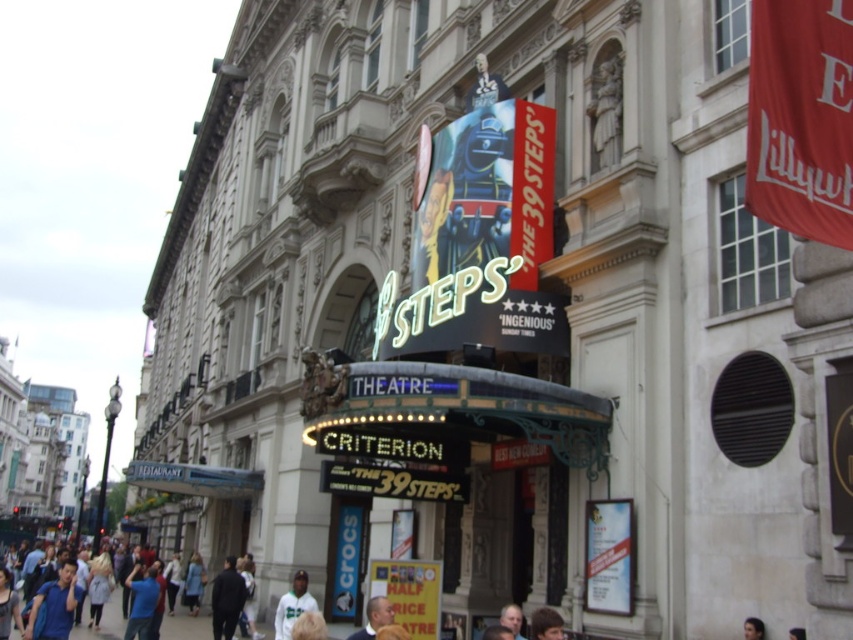
You are standing in front of the Criterion Theatre and want to find the white paper poster at lower right. Based on the scene description, where exactly would you look relative to the main entrance?

The white paper poster at lower right is located at the coordinates point [608,556] relative to the main entrance.

You are a photographer standing at the entrance of the Criterion Theatre. You want to take a photo that includes both the white plastic sign at lower center and the dark blue shirt at center. Given that your camera has a maximum focus range of 6 meters, will you be able to capture both objects in focus in a single shot?

The white plastic sign at lower center and dark blue shirt at center are 7.03 meters apart from each other. Since the distance between them exceeds the camera maximum focus range of 6 meters, the photographer cannot capture both objects in focus in a single shot.

Consider the image. You are standing in front of the Criterion Theatre and notice a white paper poster at lower right and a blue denim jacket at lower center. Which object is nearer to you?

The white paper poster at lower right is closer to the viewer than the blue denim jacket at lower center.